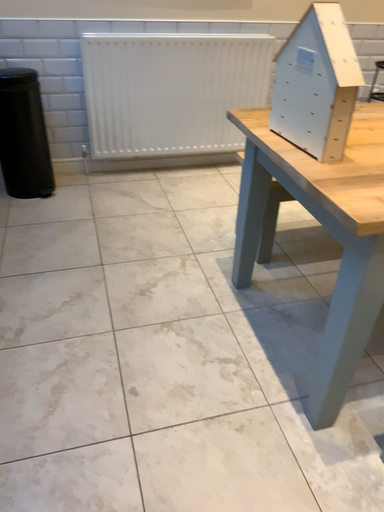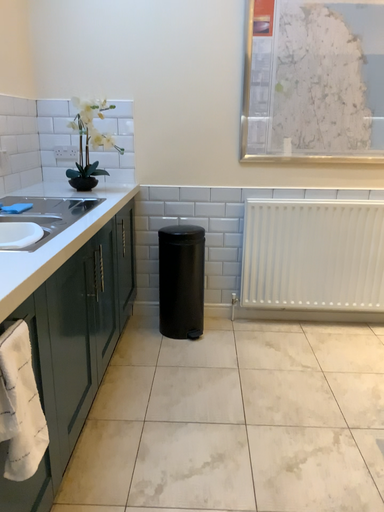
Question: Which way did the camera rotate in the video?

Choices:
 (A) rotated left
 (B) rotated right

Answer: (A)